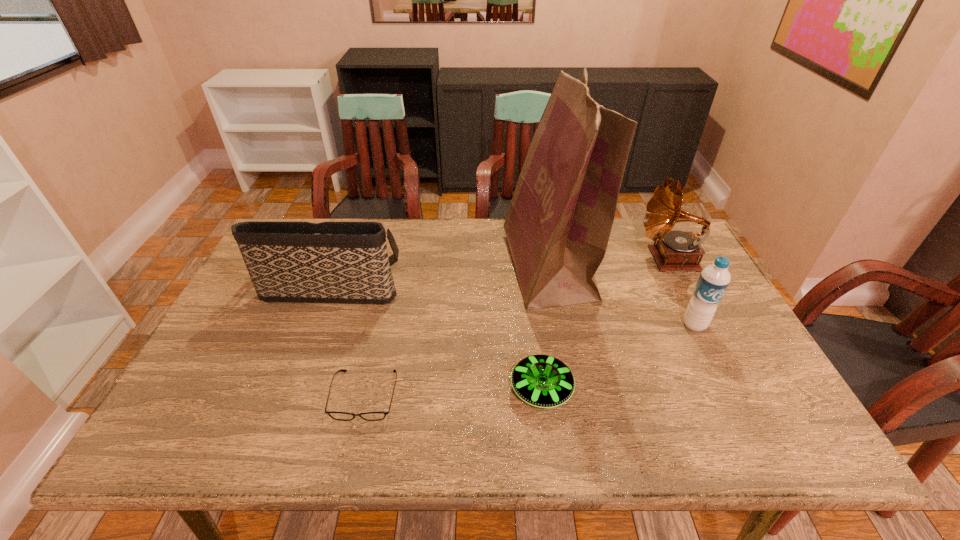
Locate an element on the screen. unoccupied area between the spectacles and the phonograph_record is located at coordinates (517, 327).

What are the coordinates of `vacant space that's between the handbag and the saucer` in the screenshot? It's located at pos(436,338).

Where is `empty space that is in between the phonograph_record and the tallest object`? Image resolution: width=960 pixels, height=540 pixels. empty space that is in between the phonograph_record and the tallest object is located at coordinates (609, 263).

Where is `free space between the phonograph_record and the tallest object`? The height and width of the screenshot is (540, 960). free space between the phonograph_record and the tallest object is located at coordinates (609, 263).

You are a GUI agent. You are given a task and a screenshot of the screen. Output one action in this format:
    pyautogui.click(x=<x>, y=<y>)
    Task: Click on the vacant space that's between the spectacles and the tallest object
    Image resolution: width=960 pixels, height=540 pixels.
    Given the screenshot: What is the action you would take?
    pyautogui.click(x=457, y=331)

In order to click on vacant area between the tallest object and the phonograph_record in this screenshot , I will do `click(609, 263)`.

Choose which object is the fifth nearest neighbor to the grocery bag. Please provide its 2D coordinates. Your answer should be formatted as a tuple, i.e. [(x, y)], where the tuple contains the x and y coordinates of a point satisfying the conditions above.

[(343, 416)]

Find the location of `the fifth closest object relative to the phonograph_record`. the fifth closest object relative to the phonograph_record is located at coordinates (343, 416).

Where is `vacant space that satisfies the following two spatial constraints: 1. on the horn of the phonograph_record; 2. on the label of the third nearest object`? vacant space that satisfies the following two spatial constraints: 1. on the horn of the phonograph_record; 2. on the label of the third nearest object is located at coordinates (704, 325).

At what (x,y) coordinates should I click in order to perform the action: click on vacant region that satisfies the following two spatial constraints: 1. on the horn of the phonograph_record; 2. on the label of the third nearest object. Please return your answer as a coordinate pair (x, y). Looking at the image, I should click on (704, 325).